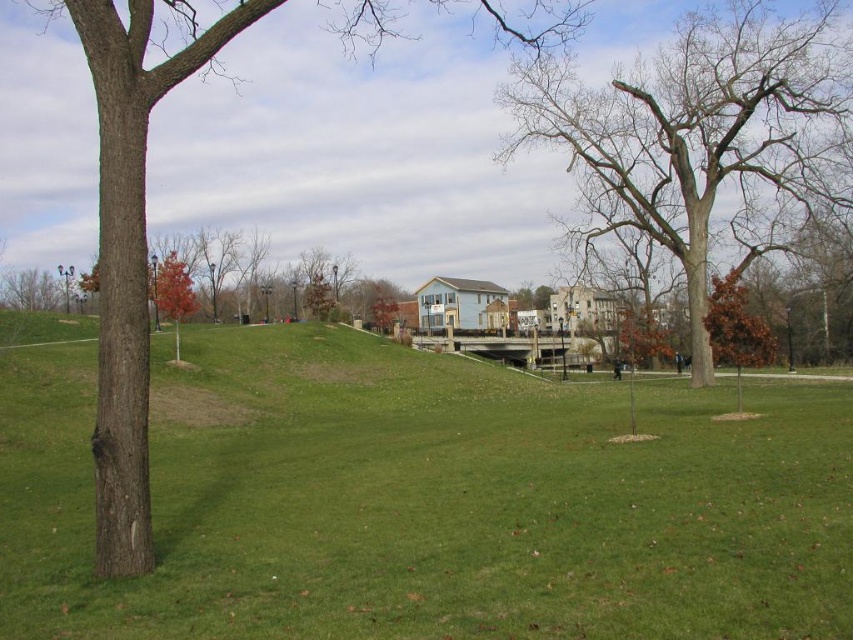
Which of these two, green grassy at center or bare wood tree at center, stands taller?

bare wood tree at center

Can you confirm if green grassy at center is positioned to the right of bare wood tree at center?

In fact, green grassy at center is to the left of bare wood tree at center.

Does point (64, 564) come farther from viewer compared to point (527, 80)?

No.

Locate an element on the screen. This screenshot has width=853, height=640. green grassy at center is located at coordinates (427, 500).

Is bare wood tree at center shorter than brown rough bark tree at left?

Yes, bare wood tree at center is shorter than brown rough bark tree at left.

Is bare wood tree at center behind brown rough bark tree at left?

Yes, bare wood tree at center is behind brown rough bark tree at left.

Between point (695, 72) and point (120, 257), which one is positioned behind?

The point (695, 72) is behind.

You are a GUI agent. You are given a task and a screenshot of the screen. Output one action in this format:
    pyautogui.click(x=<x>, y=<y>)
    Task: Click on the bare wood tree at center
    The width and height of the screenshot is (853, 640).
    Given the screenshot: What is the action you would take?
    pyautogui.click(x=685, y=131)

Between point (724, 561) and point (132, 316), which one is positioned behind?

Point (132, 316)

Does green grassy at center appear over brown rough bark tree at left?

No.

What do you see at coordinates (427, 500) in the screenshot? I see `green grassy at center` at bounding box center [427, 500].

I want to click on green grassy at center, so click(427, 500).